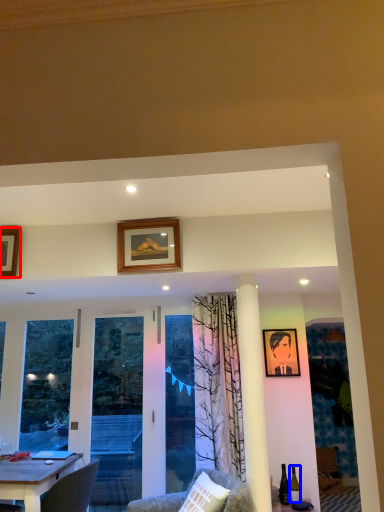
Question: Which object is closer to the camera taking this photo, picture frame (highlighted by a red box) or wine bottle (highlighted by a blue box)?

Choices:
 (A) picture frame
 (B) wine bottle

Answer: (A)